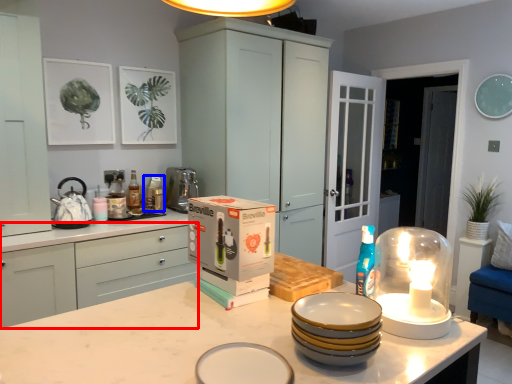
Question: Which of the following is the closest to the observer, cabinetry (highlighted by a red box) or appliance (highlighted by a blue box)?

Choices:
 (A) cabinetry
 (B) appliance

Answer: (A)